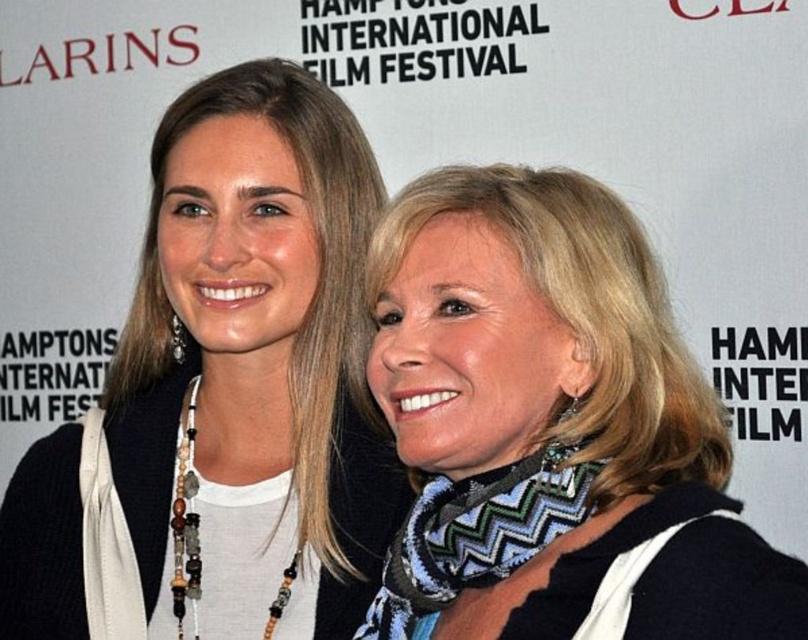
Question: Can you confirm if matte black scarf at upper center is smaller than blue zigzag scarf at center?

Choices:
 (A) no
 (B) yes

Answer: (A)

Question: Is matte black scarf at upper center to the left of blue zigzag scarf at center from the viewer's perspective?

Choices:
 (A) yes
 (B) no

Answer: (A)

Question: Which point is closer to the camera?

Choices:
 (A) matte black scarf at upper center
 (B) blue zigzag scarf at center

Answer: (B)

Question: From the image, what is the correct spatial relationship of matte black scarf at upper center in relation to blue zigzag scarf at center?

Choices:
 (A) below
 (B) above

Answer: (B)